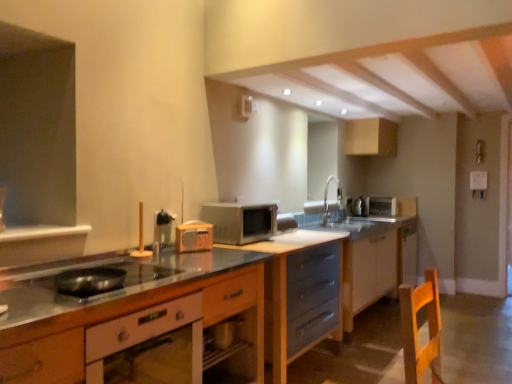
Locate an element on the screen. This screenshot has width=512, height=384. metallic silver microwave at center, the 1th appliance in the back-to-front sequence is located at coordinates (381, 206).

Where is `matte wood cabinet at center, which is the 5th cabinetry in back-to-front order`? matte wood cabinet at center, which is the 5th cabinetry in back-to-front order is located at coordinates (130, 320).

Where is `matte gray drawers at center, the third cabinetry when ordered from back to front`? matte gray drawers at center, the third cabinetry when ordered from back to front is located at coordinates [372, 259].

What is the approximate width of satin silver microwave at center?

The width of satin silver microwave at center is 14.60 inches.

What do you see at coordinates (240, 222) in the screenshot? The image size is (512, 384). I see `satin silver microwave at center` at bounding box center [240, 222].

Locate an element on the screen. Image resolution: width=512 pixels, height=384 pixels. matte wood cabinet at upper center, marked as the 1th cabinetry in a back-to-front arrangement is located at coordinates (371, 137).

This screenshot has height=384, width=512. What are the coordinates of `black matte pan at left` in the screenshot? It's located at (96, 280).

From the image's perspective, starting from the metallic silver microwave at center, positioned as the 1th appliance in right-to-left order, which cabinetry is the 3rd one below? Please provide its 2D coordinates.

[(300, 293)]

From the image's perspective, is matte gray drawers at center, positioned as the 2th cabinetry in front-to-back order, located beneath metallic silver microwave at center, positioned as the 1th appliance in right-to-left order?

Indeed, from the image's perspective, matte gray drawers at center, positioned as the 2th cabinetry in front-to-back order, is shown beneath metallic silver microwave at center, positioned as the 1th appliance in right-to-left order.

How distant is matte gray drawers at center, the 4th cabinetry in the back-to-front sequence, from metallic silver microwave at center, positioned as the 1th appliance in right-to-left order?

matte gray drawers at center, the 4th cabinetry in the back-to-front sequence, is 1.95 meters from metallic silver microwave at center, positioned as the 1th appliance in right-to-left order.

In terms of height, does matte gray drawers at center, positioned as the 2th cabinetry in front-to-back order, look taller or shorter compared to metallic silver microwave at center, positioned as the 1th appliance in right-to-left order?

Considering their sizes, matte gray drawers at center, positioned as the 2th cabinetry in front-to-back order, has more height than metallic silver microwave at center, positioned as the 1th appliance in right-to-left order.

Considering the relative sizes of matte wood cabinet at center, the 1th cabinetry positioned from the front, and satin silver microwave at center in the image provided, is matte wood cabinet at center, the 1th cabinetry positioned from the front, wider than satin silver microwave at center?

Indeed, matte wood cabinet at center, the 1th cabinetry positioned from the front, has a greater width compared to satin silver microwave at center.

In the scene shown: From the image's perspective, is matte wood cabinet at center, the 1th cabinetry positioned from the front, positioned above or below satin silver microwave at center?

Based on their image positions, matte wood cabinet at center, the 1th cabinetry positioned from the front, is located beneath satin silver microwave at center.

Which is farther, (69, 327) or (215, 225)?

The point (215, 225) is farther.

Consider the image. Considering the relative positions of matte wood cabinet at center, the 1th cabinetry positioned from the front, and satin silver microwave at center in the image provided, is matte wood cabinet at center, the 1th cabinetry positioned from the front, to the left of satin silver microwave at center from the viewer's perspective?

Correct, you'll find matte wood cabinet at center, the 1th cabinetry positioned from the front, to the left of satin silver microwave at center.

Is satin silver toaster at upper center, the 2th appliance viewed from the left, closer to camera compared to matte gray drawers at center, positioned as the 2th cabinetry in front-to-back order?

No, it is behind matte gray drawers at center, positioned as the 2th cabinetry in front-to-back order.

Which point is more distant from viewer, (364, 202) or (273, 307)?

The point (364, 202) is farther.

From a real-world perspective, is satin silver toaster at upper center, marked as the 2th appliance in a front-to-back arrangement, beneath matte gray drawers at center, the 4th cabinetry in the back-to-front sequence?

No, from a real-world perspective, satin silver toaster at upper center, marked as the 2th appliance in a front-to-back arrangement, is not below matte gray drawers at center, the 4th cabinetry in the back-to-front sequence.

Is satin silver toaster at upper center, the second appliance viewed from the right, positioned with its back to matte gray drawers at center, positioned as the 2th cabinetry in front-to-back order?

No, matte gray drawers at center, positioned as the 2th cabinetry in front-to-back order, is not at the back of satin silver toaster at upper center, the second appliance viewed from the right.

Is black matte pan at left wider or thinner than matte wood cabinet at center, which is the 5th cabinetry in back-to-front order?

black matte pan at left is thinner than matte wood cabinet at center, which is the 5th cabinetry in back-to-front order.

This screenshot has width=512, height=384. I want to click on gas stove lying behind the matte wood cabinet at center, which is the 5th cabinetry in back-to-front order, so click(x=96, y=280).

Looking at this image, are black matte pan at left and matte wood cabinet at center, which is the 5th cabinetry in back-to-front order, far apart?

black matte pan at left is actually quite close to matte wood cabinet at center, which is the 5th cabinetry in back-to-front order.

From a real-world perspective, between black matte pan at left and matte wood cabinet at center, the 1th cabinetry positioned from the front, who is vertically higher?

From a 3D spatial view, black matte pan at left is above.

Considering the sizes of metallic silver microwave at center, which ranks as the 3th appliance in left-to-right order, and satin silver toaster at upper center, the second appliance positioned from the back, in the image, is metallic silver microwave at center, which ranks as the 3th appliance in left-to-right order, wider or thinner than satin silver toaster at upper center, the second appliance positioned from the back,?

Clearly, metallic silver microwave at center, which ranks as the 3th appliance in left-to-right order, has more width compared to satin silver toaster at upper center, the second appliance positioned from the back.

In the scene shown: Considering their positions, is metallic silver microwave at center, placed as the 3th appliance when sorted from front to back, located in front of or behind satin silver toaster at upper center, the 2th appliance viewed from the left?

Visually, metallic silver microwave at center, placed as the 3th appliance when sorted from front to back, is located behind satin silver toaster at upper center, the 2th appliance viewed from the left.

From the image's perspective, is metallic silver microwave at center, placed as the 3th appliance when sorted from front to back, beneath satin silver toaster at upper center, the 2th appliance viewed from the left?

Correct, metallic silver microwave at center, placed as the 3th appliance when sorted from front to back, appears lower than satin silver toaster at upper center, the 2th appliance viewed from the left, in the image.

From a real-world perspective, between white glossy cabinet at lower right, which is the 4th cabinetry in front-to-back order, and matte wood cabinet at upper center, the fifth cabinetry in the front-to-back sequence, who is vertically higher?

matte wood cabinet at upper center, the fifth cabinetry in the front-to-back sequence, is physically above.

Measure the distance between white glossy cabinet at lower right, the second cabinetry when ordered from back to front, and matte wood cabinet at upper center, marked as the 1th cabinetry in a back-to-front arrangement.

The distance of white glossy cabinet at lower right, the second cabinetry when ordered from back to front, from matte wood cabinet at upper center, marked as the 1th cabinetry in a back-to-front arrangement, is 4.74 feet.

Is white glossy cabinet at lower right, which is the 4th cabinetry in front-to-back order, directly adjacent to matte wood cabinet at upper center, marked as the 1th cabinetry in a back-to-front arrangement?

No, white glossy cabinet at lower right, which is the 4th cabinetry in front-to-back order, is not making contact with matte wood cabinet at upper center, marked as the 1th cabinetry in a back-to-front arrangement.

In the scene shown: In the image, is white glossy cabinet at lower right, which is the 4th cabinetry in front-to-back order, positioned in front of or behind matte wood cabinet at upper center, marked as the 1th cabinetry in a back-to-front arrangement?

In the image, white glossy cabinet at lower right, which is the 4th cabinetry in front-to-back order, appears in front of matte wood cabinet at upper center, marked as the 1th cabinetry in a back-to-front arrangement.

Based on the photo, can you tell me how much silver metallic faucet at upper center and matte gray drawers at center, positioned as the 2th cabinetry in front-to-back order, differ in facing direction?

40.8 degrees.

Which of these two, silver metallic faucet at upper center or matte gray drawers at center, the 4th cabinetry in the back-to-front sequence, is bigger?

Bigger between the two is matte gray drawers at center, the 4th cabinetry in the back-to-front sequence.

Can you see silver metallic faucet at upper center touching matte gray drawers at center, the 4th cabinetry in the back-to-front sequence?

No, silver metallic faucet at upper center is not making contact with matte gray drawers at center, the 4th cabinetry in the back-to-front sequence.

How far apart are silver metallic faucet at upper center and matte gray drawers at center, positioned as the 2th cabinetry in front-to-back order?

silver metallic faucet at upper center and matte gray drawers at center, positioned as the 2th cabinetry in front-to-back order, are 35.41 inches apart from each other.

Locate an element on the screen. Image resolution: width=512 pixels, height=384 pixels. cabinetry that is the 4th one when counting leftward from the metallic silver microwave at center, positioned as the 1th appliance in right-to-left order is located at coordinates (300, 293).

Locate an element on the screen. Image resolution: width=512 pixels, height=384 pixels. microwave oven located on the right of matte wood cabinet at center, the 1th cabinetry positioned from the front is located at coordinates (240, 222).

From the image, which object appears to be farther from matte wood cabinet at upper center, the fifth cabinetry in the front-to-back sequence, matte wood cabinet at center, the 1th cabinetry positioned from the front, or matte gray drawers at center, the 4th cabinetry in the back-to-front sequence?

Based on the image, matte wood cabinet at center, the 1th cabinetry positioned from the front, appears to be further to matte wood cabinet at upper center, the fifth cabinetry in the front-to-back sequence.

Estimate the real-world distances between objects in this image. Which object is closer to matte black exhaust hood at upper left, white glossy cabinet at lower right, the second cabinetry when ordered from back to front, or wooden radio at center, the 1th appliance viewed from the left?

white glossy cabinet at lower right, the second cabinetry when ordered from back to front, is closer to matte black exhaust hood at upper left.

From the image, which object appears to be farther from satin silver microwave at center, black matte pan at left or satin silver toaster at upper center, the second appliance positioned from the back?

Among the two, satin silver toaster at upper center, the second appliance positioned from the back, is located further to satin silver microwave at center.

From the image, which object appears to be nearer to satin silver microwave at center, matte wood cabinet at upper center, the fifth cabinetry in the front-to-back sequence, or white glossy cabinet at lower right, which is the 4th cabinetry in front-to-back order?

Among the two, white glossy cabinet at lower right, which is the 4th cabinetry in front-to-back order, is located nearer to satin silver microwave at center.

Considering their positions, is wooden radio at center, placed as the 1th appliance when sorted from front to back, positioned further to white glossy cabinet at lower right, which is the 4th cabinetry in front-to-back order, than matte black exhaust hood at upper left?

wooden radio at center, placed as the 1th appliance when sorted from front to back, lies further to white glossy cabinet at lower right, which is the 4th cabinetry in front-to-back order, than the other object.

From the image, which object appears to be farther from metallic silver microwave at center, placed as the 3th appliance when sorted from front to back, matte wood cabinet at center, the 1th cabinetry positioned from the front, or wooden radio at center, the 1th appliance viewed from the left?

matte wood cabinet at center, the 1th cabinetry positioned from the front, lies further to metallic silver microwave at center, placed as the 3th appliance when sorted from front to back, than the other object.

From the image, which object appears to be nearer to wooden radio at center, the third appliance in the back-to-front sequence, white glossy cabinet at lower right, the second cabinetry when ordered from back to front, or metallic silver microwave at center, positioned as the 1th appliance in right-to-left order?

white glossy cabinet at lower right, the second cabinetry when ordered from back to front, is closer to wooden radio at center, the third appliance in the back-to-front sequence.

Based on their spatial positions, is satin silver toaster at upper center, the second appliance positioned from the back, or matte wood cabinet at upper center, marked as the 1th cabinetry in a back-to-front arrangement, further from white glossy cabinet at lower right, the second cabinetry when ordered from back to front?

matte wood cabinet at upper center, marked as the 1th cabinetry in a back-to-front arrangement.

Identify the location of faucet between matte gray drawers at center, the third cabinetry when ordered from back to front, and matte wood cabinet at upper center, the fifth cabinetry in the front-to-back sequence, in the front-back direction. Image resolution: width=512 pixels, height=384 pixels. (327, 199).

You are a GUI agent. You are given a task and a screenshot of the screen. Output one action in this format:
    pyautogui.click(x=<x>, y=<y>)
    Task: Click on the microwave oven between matte gray drawers at center, the 4th cabinetry in the back-to-front sequence, and satin silver toaster at upper center, the second appliance positioned from the back, from front to back
    The height and width of the screenshot is (384, 512).
    Given the screenshot: What is the action you would take?
    pyautogui.click(x=240, y=222)

Locate an element on the screen. Image resolution: width=512 pixels, height=384 pixels. cabinetry between matte wood cabinet at upper center, the fifth cabinetry in the front-to-back sequence, and white glossy cabinet at lower right, the second cabinetry when ordered from back to front, from top to bottom is located at coordinates (372, 259).

Where is `faucet positioned between satin silver microwave at center and metallic silver microwave at center, positioned as the 1th appliance in right-to-left order, from near to far`? Image resolution: width=512 pixels, height=384 pixels. faucet positioned between satin silver microwave at center and metallic silver microwave at center, positioned as the 1th appliance in right-to-left order, from near to far is located at coordinates (327, 199).